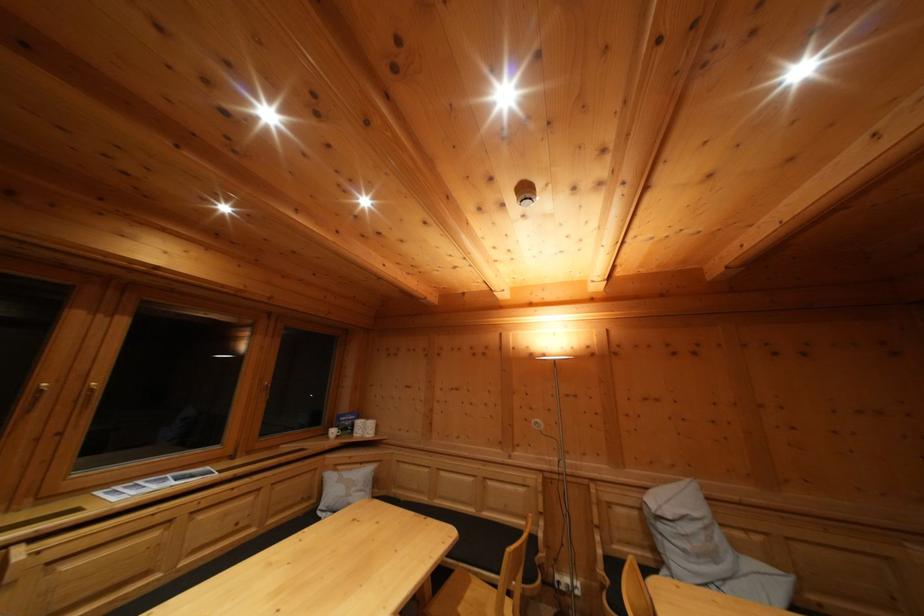
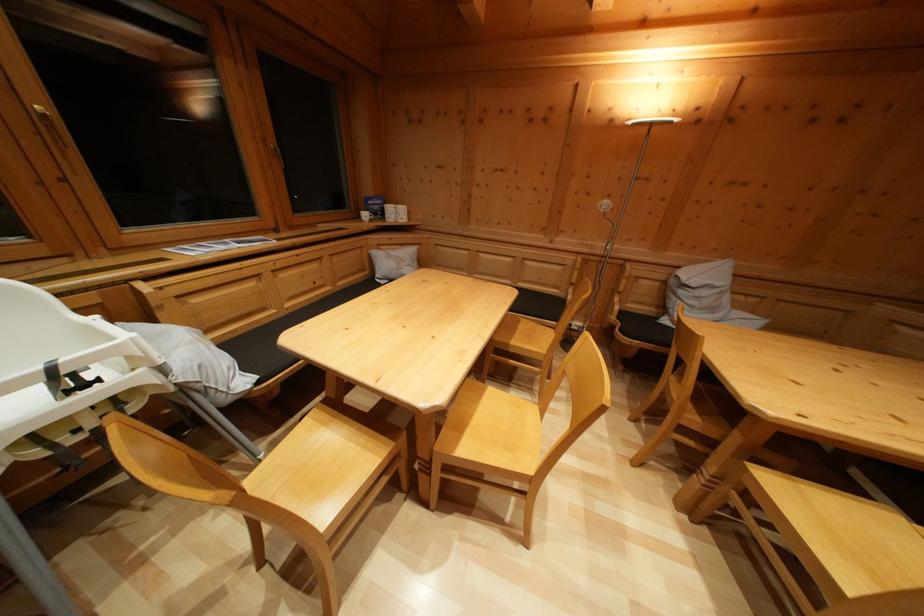
In the second image, find the point that corresponds to (164,586) in the first image.

(282, 321)